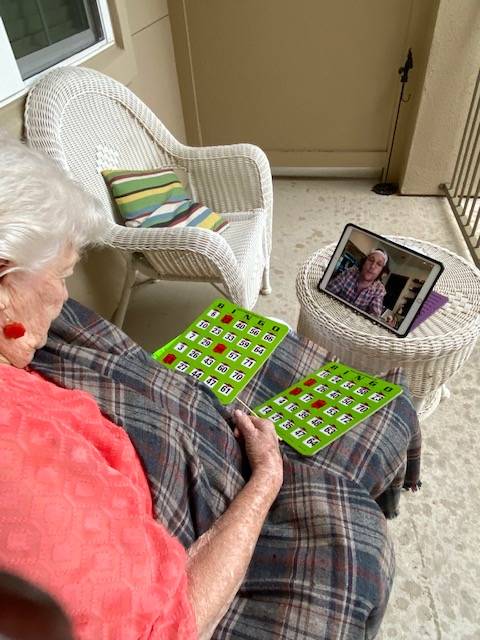
You are a GUI agent. You are given a task and a screenshot of the screen. Output one action in this format:
    pyautogui.click(x=<x>, y=<y>)
    Task: Click on the striped pillow
    The width and height of the screenshot is (480, 640).
    Given the screenshot: What is the action you would take?
    pyautogui.click(x=158, y=201)